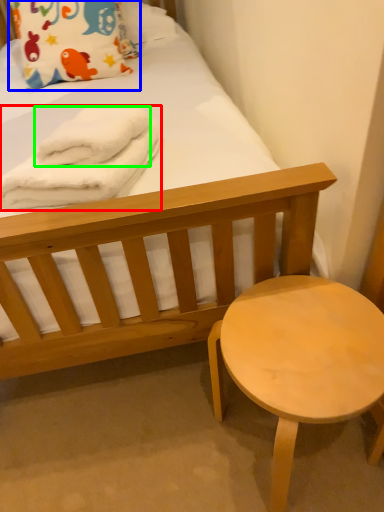
Question: Which object is positioned farthest from bath towel (highlighted by a red box)? Select from pillow (highlighted by a blue box) and bath towel (highlighted by a green box).

Choices:
 (A) pillow
 (B) bath towel

Answer: (A)